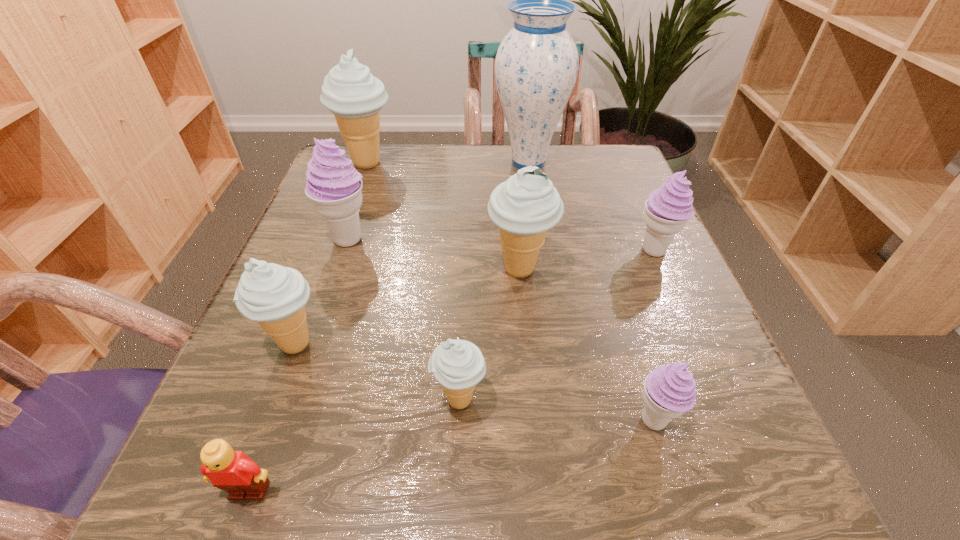
Locate which icecream ranks fifth in proximity to the third farthest beige icecream. Please provide its 2D coordinates. Your answer should be formatted as a tuple, i.e. [(x, y)], where the tuple contains the x and y coordinates of a point satisfying the conditions above.

[(669, 391)]

Locate an element on the screen. Image resolution: width=960 pixels, height=540 pixels. the fifth closest icecream to the leftmost purple icecream is located at coordinates (668, 208).

The image size is (960, 540). In order to click on beige icecream that is the third closest to the tallest object in this screenshot , I will do `click(274, 295)`.

Where is `beige icecream identified as the closest to the smallest purple icecream`? The height and width of the screenshot is (540, 960). beige icecream identified as the closest to the smallest purple icecream is located at coordinates point(458,365).

Find the location of `the third closest purple icecream to the second biggest beige icecream`. the third closest purple icecream to the second biggest beige icecream is located at coordinates (334, 187).

Identify the location of purple icecream that stands as the closest to the brown Lego. This screenshot has width=960, height=540. (334, 187).

Identify the location of vacant space that satisfies the following two spatial constraints: 1. on the front side of the leftmost purple icecream; 2. on the right side of the second biggest purple icecream. The height and width of the screenshot is (540, 960). (345, 251).

This screenshot has width=960, height=540. I want to click on free space that satisfies the following two spatial constraints: 1. on the back side of the tallest object; 2. on the right side of the third nearest beige icecream, so click(510, 163).

Identify the location of vacant space that satisfies the following two spatial constraints: 1. on the front side of the farthest beige icecream; 2. on the left side of the second biggest beige icecream. This screenshot has height=540, width=960. (329, 269).